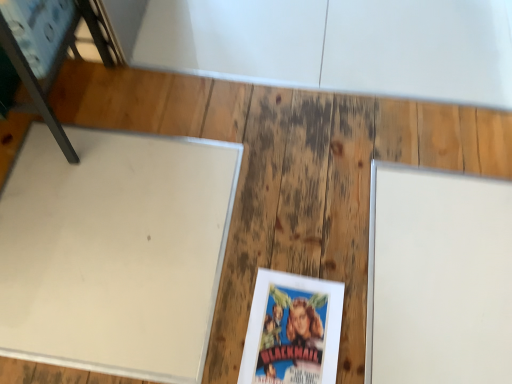
Where is `free area in between white matte board at right and white matte board at left`? Image resolution: width=512 pixels, height=384 pixels. free area in between white matte board at right and white matte board at left is located at coordinates (295, 264).